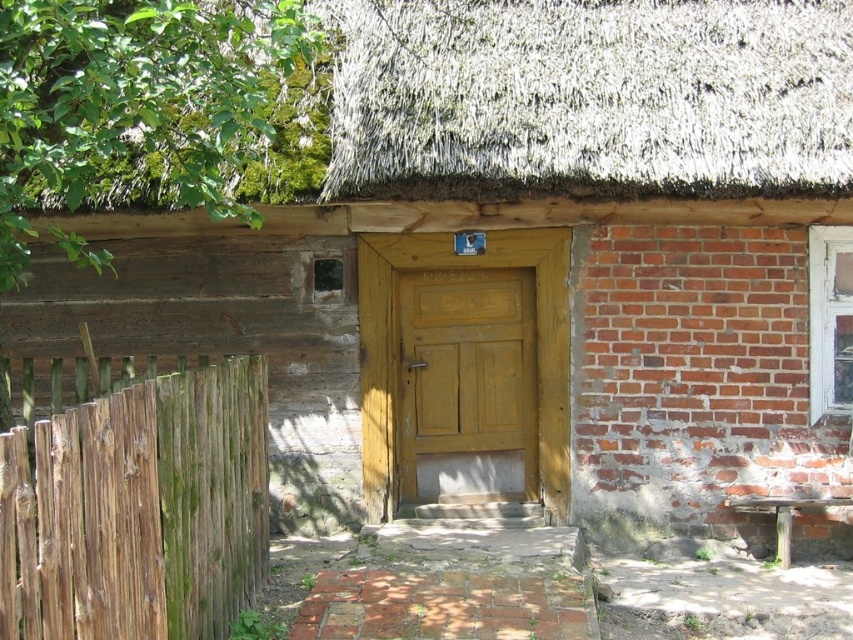
You are standing in front of the house and want to enter through the wooden door at center. There is a green mossy wood fence at left blocking your path. Can you walk around the fence to reach the door?

The green mossy wood fence at left is to the left of the wooden door at center, so you can walk around the fence to the right side to reach the wooden door at center.

You are standing in front of the house and want to hang a wreath on the wooden door at center. To ensure the wreath is placed correctly, where should you position it relative to the thatched straw roof at upper center?

The wooden door at center is below the thatched straw roof at upper center, so you should place the wreath on the wooden door at center, which is positioned below the thatched straw roof at upper center.

You are standing in front of the rustic house and want to determine the relative positions of two points marked on the house. The first point is at coordinate point (x=514, y=136) and the second is at point (x=170, y=561). Which point is closer to you?

Point (x=514, y=136) is further to the viewer than point (x=170, y=561), so the point closer to you is point (x=170, y=561).